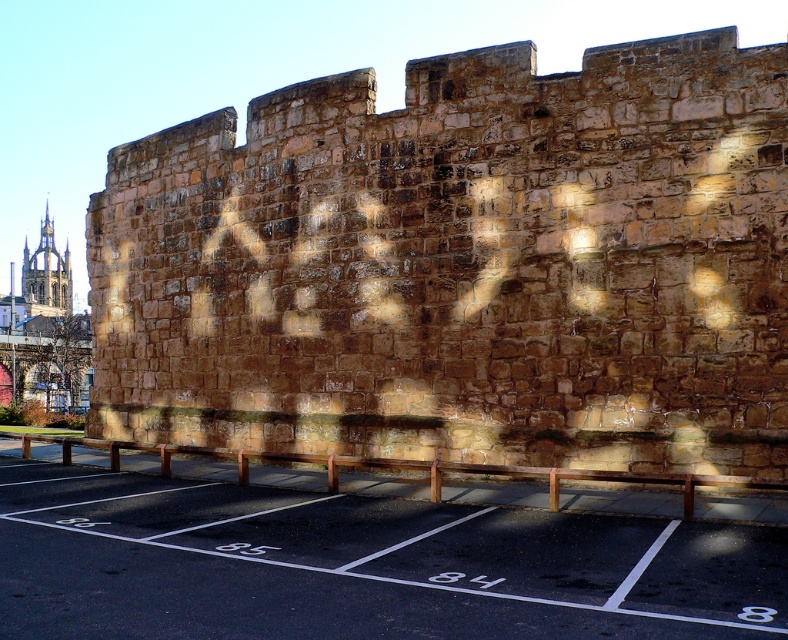
Does black asphalt parking lot at lower center have a smaller size compared to golden stone tower at upper left?

Indeed, black asphalt parking lot at lower center has a smaller size compared to golden stone tower at upper left.

Is point (4, 621) positioned before point (25, 280)?

Yes.

Locate an element on the screen. black asphalt parking lot at lower center is located at coordinates (359, 564).

Is point (108, 317) closer to camera compared to point (705, 608)?

No, it is behind (705, 608).

Who is higher up, brown stone wall at center or black asphalt parking lot at lower center?

Positioned higher is brown stone wall at center.

Which is behind, point (552, 170) or point (86, 540)?

The point (552, 170) is behind.

Locate an element on the screen. The height and width of the screenshot is (640, 788). brown stone wall at center is located at coordinates (463, 266).

Is brown stone wall at center below golden stone tower at upper left?

Yes.

Between brown stone wall at center and golden stone tower at upper left, which one has more height?

golden stone tower at upper left is taller.

Where is `brown stone wall at center`? This screenshot has height=640, width=788. brown stone wall at center is located at coordinates coord(463,266).